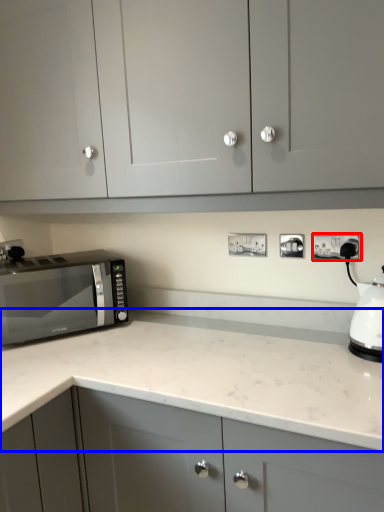
Question: Which point is further to the camera, electric outlet (highlighted by a red box) or countertop (highlighted by a blue box)?

Choices:
 (A) electric outlet
 (B) countertop

Answer: (A)